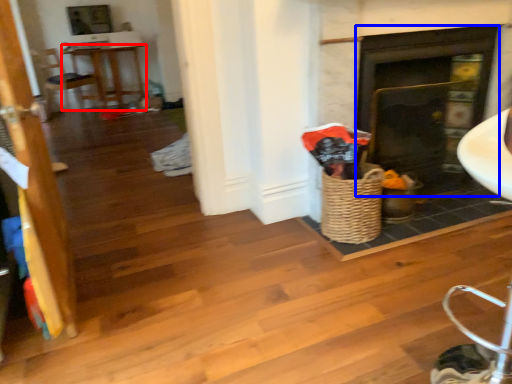
Question: Which point is closer to the camera, table (highlighted by a red box) or fireplace (highlighted by a blue box)?

Choices:
 (A) table
 (B) fireplace

Answer: (B)